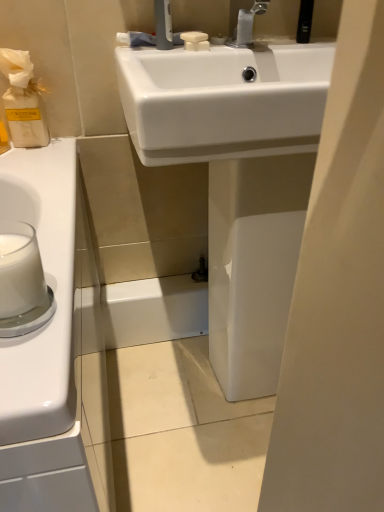
Question: From the image's perspective, relative to white glossy sink at center, is white opaque glass at left above or below?

Choices:
 (A) above
 (B) below

Answer: (B)

Question: Considering their positions, is white opaque glass at left located in front of or behind white glossy sink at center?

Choices:
 (A) front
 (B) behind

Answer: (A)

Question: Estimate the real-world distances between objects in this image. Which object is closer to the white matte soap at upper center?

Choices:
 (A) white glossy sink at center
 (B) silver metallic faucet at upper center
 (C) white opaque glass at left

Answer: (B)

Question: Which of these objects is positioned closest to the white glossy sink at center?

Choices:
 (A) white opaque glass at left
 (B) silver metallic faucet at upper center
 (C) white matte soap at upper center

Answer: (C)